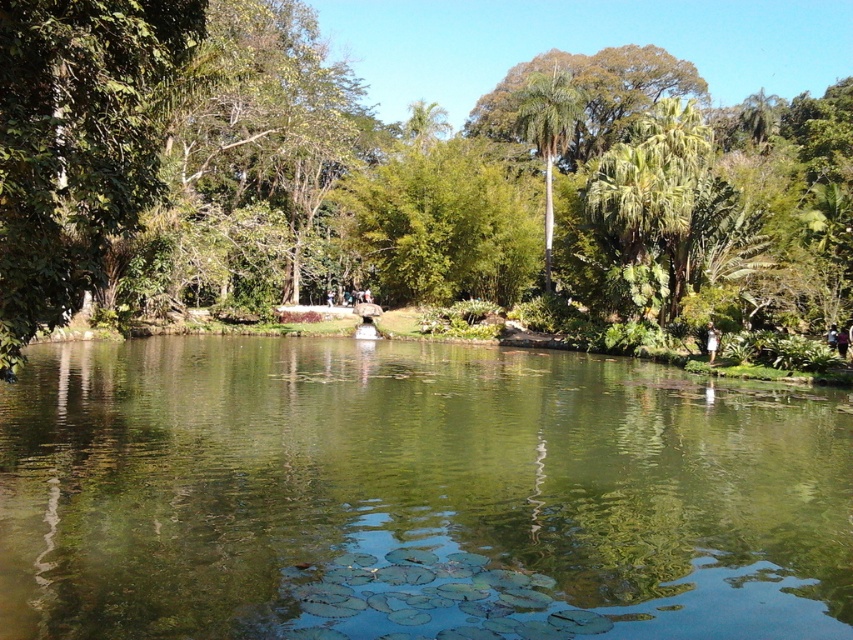
Question: Observing the image, what is the correct spatial positioning of green reflective water at center in reference to green leafy tree at center?

Choices:
 (A) below
 (B) above

Answer: (A)

Question: Which object is positioned closest to the green leafy tree at center?

Choices:
 (A) green leafy palm tree at center
 (B) green reflective water at center

Answer: (A)

Question: Which of these objects is positioned farthest from the green reflective water at center?

Choices:
 (A) green leafy palm tree at center
 (B) green leafy tree at center

Answer: (A)

Question: In this image, where is green reflective water at center located relative to green leafy palm tree at center?

Choices:
 (A) left
 (B) right

Answer: (A)

Question: Can you confirm if green leafy tree at center is positioned above green leafy palm tree at center?

Choices:
 (A) yes
 (B) no

Answer: (B)

Question: Which is nearer to the green leafy tree at center?

Choices:
 (A) green leafy palm tree at center
 (B) green reflective water at center

Answer: (A)